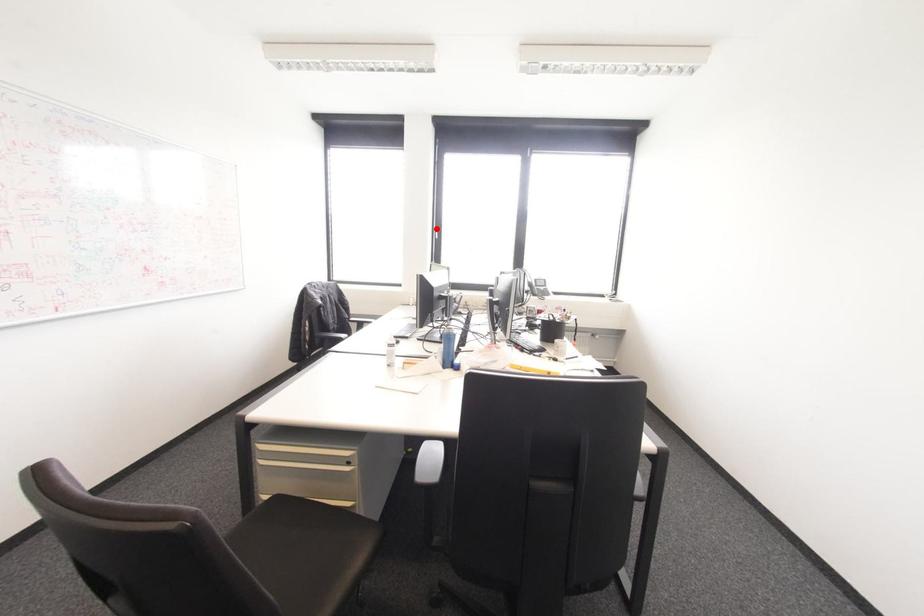
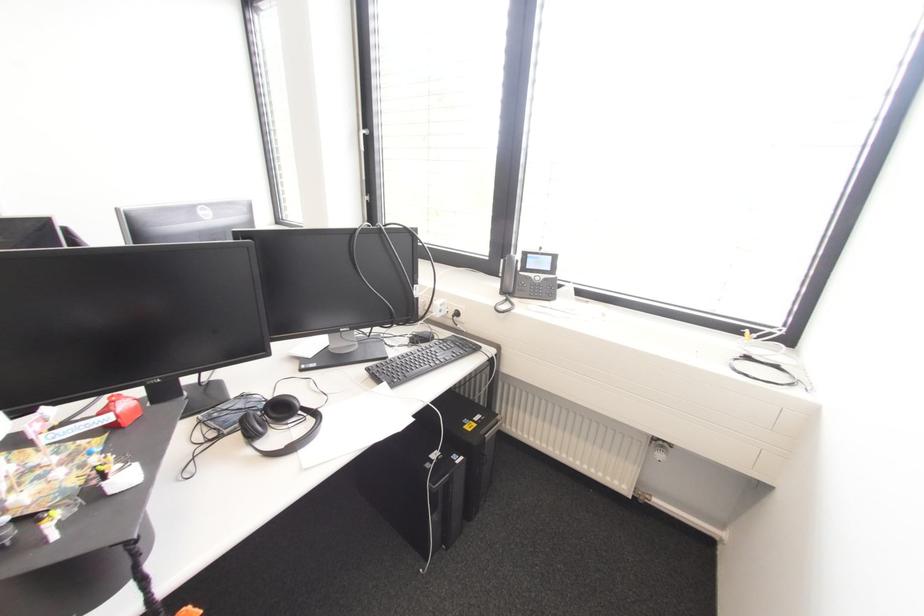
Find the pixel in the second image that matches the highlighted location in the first image.

(361, 132)